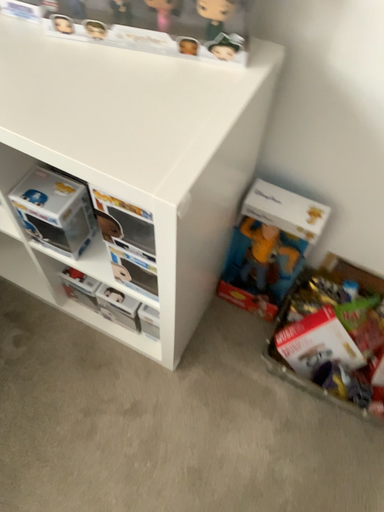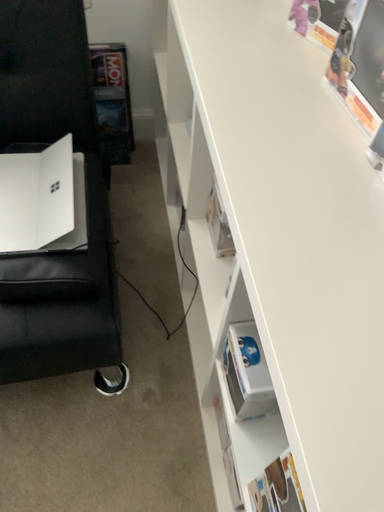
Question: Which way did the camera rotate in the video?

Choices:
 (A) rotated upward
 (B) rotated downward

Answer: (A)